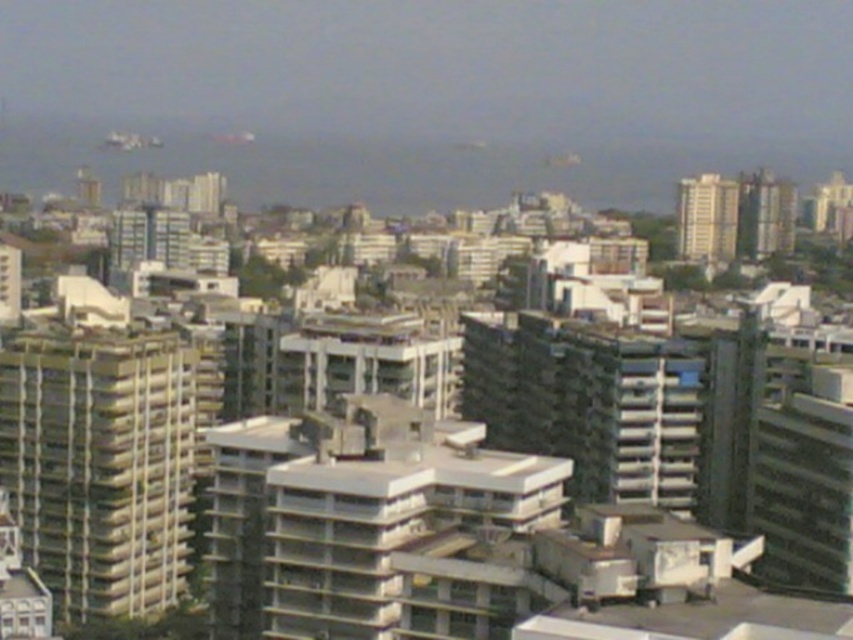
Question: Which point appears farthest from the camera in this image?

Choices:
 (A) (753, 220)
 (B) (107, 428)
 (C) (717, 220)

Answer: (A)

Question: Which of the following is the farthest from the observer?

Choices:
 (A) beige concrete building at center
 (B) smooth beige building at upper right
 (C) beige concrete building at left

Answer: (B)

Question: Is beige concrete building at left bigger than smooth beige building at upper right?

Choices:
 (A) no
 (B) yes

Answer: (B)

Question: Is beige concrete building at left bigger than beige concrete building at center?

Choices:
 (A) yes
 (B) no

Answer: (A)

Question: Is beige concrete building at left to the left of beige concrete building at center from the viewer's perspective?

Choices:
 (A) no
 (B) yes

Answer: (B)

Question: Estimate the real-world distances between objects in this image. Which object is closer to the beige concrete building at center?

Choices:
 (A) smooth beige building at upper right
 (B) beige concrete building at left

Answer: (A)